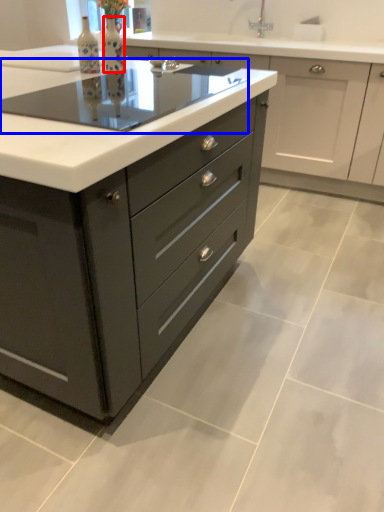
Question: Among these objects, which one is nearest to the camera, bottle (highlighted by a red box) or appliance (highlighted by a blue box)?

Choices:
 (A) bottle
 (B) appliance

Answer: (B)